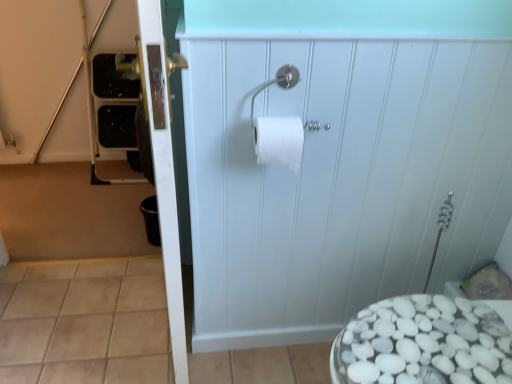
The width and height of the screenshot is (512, 384). I want to click on white matte toilet paper at center, so tap(279, 141).

The width and height of the screenshot is (512, 384). I want to click on white matte cabinet at center, which is counted as the first screen door, starting from the right, so click(x=340, y=180).

Is white matte toilet paper at center positioned with its back to white glossy door at left, acting as the first screen door starting from the left?

No, white matte toilet paper at center is not facing the opposite direction of white glossy door at left, acting as the first screen door starting from the left.

Is white matte toilet paper at center smaller than white glossy door at left, acting as the first screen door starting from the left?

Indeed, white matte toilet paper at center has a smaller size compared to white glossy door at left, acting as the first screen door starting from the left.

Which object is wider, white matte toilet paper at center or white glossy door at left, the 2th screen door in the right-to-left sequence?

white glossy door at left, the 2th screen door in the right-to-left sequence.

Does point (259, 121) appear closer or farther from the camera than point (165, 87)?

Point (259, 121) is positioned farther from the camera compared to point (165, 87).

Would you say white matte cabinet at center, which is counted as the first screen door, starting from the right, is inside or outside silver metallic toilet paper holder at upper center?

white matte cabinet at center, which is counted as the first screen door, starting from the right, lies outside silver metallic toilet paper holder at upper center.

From the picture: Considering the relative positions of white matte cabinet at center, which is counted as the first screen door, starting from the right, and silver metallic toilet paper holder at upper center in the image provided, is white matte cabinet at center, which is counted as the first screen door, starting from the right, to the left of silver metallic toilet paper holder at upper center from the viewer's perspective?

No, white matte cabinet at center, which is counted as the first screen door, starting from the right, is not to the left of silver metallic toilet paper holder at upper center.

Which is behind, point (481, 171) or point (296, 81)?

The point (481, 171) is farther.

What are the coordinates of `the 2nd screen door positioned below the silver metallic toilet paper holder at upper center (from the image's perspective)` in the screenshot? It's located at (340, 180).

Visually, is white matte toilet paper at center positioned to the left or to the right of silver metallic toilet paper holder at upper center?

white matte toilet paper at center is positioned on silver metallic toilet paper holder at upper center's left side.

Where is `towel bar in front of the white matte toilet paper at center`? The image size is (512, 384). towel bar in front of the white matte toilet paper at center is located at coordinates (279, 83).

Which is behind, white matte toilet paper at center or silver metallic toilet paper holder at upper center?

white matte toilet paper at center is further away from the camera.

Can you confirm if white matte toilet paper at center is shorter than silver metallic toilet paper holder at upper center?

Incorrect, the height of white matte toilet paper at center does not fall short of that of silver metallic toilet paper holder at upper center.

Considering the relative positions of silver metallic toilet paper holder at upper center and white glossy door at left, acting as the first screen door starting from the left, in the image provided, is silver metallic toilet paper holder at upper center to the right of white glossy door at left, acting as the first screen door starting from the left, from the viewer's perspective?

Indeed, silver metallic toilet paper holder at upper center is positioned on the right side of white glossy door at left, acting as the first screen door starting from the left.

Would you say silver metallic toilet paper holder at upper center is a long distance from white glossy door at left, acting as the first screen door starting from the left?

No, there isn't a large distance between silver metallic toilet paper holder at upper center and white glossy door at left, acting as the first screen door starting from the left.

Which is behind, point (290, 86) or point (159, 150)?

Point (290, 86)

Is silver metallic toilet paper holder at upper center oriented towards white glossy door at left, acting as the first screen door starting from the left?

No.

Measure the distance between white matte cabinet at center, which is counted as the first screen door, starting from the right, and white matte toilet paper at center.

The distance of white matte cabinet at center, which is counted as the first screen door, starting from the right, from white matte toilet paper at center is 12.90 inches.

Based on their sizes in the image, would you say white matte cabinet at center, which is counted as the second screen door, starting from the left, is bigger or smaller than white matte toilet paper at center?

white matte cabinet at center, which is counted as the second screen door, starting from the left, is bigger than white matte toilet paper at center.

Looking at this image, is white matte cabinet at center, which is counted as the first screen door, starting from the right, aimed at white matte toilet paper at center?

Yes, white matte cabinet at center, which is counted as the first screen door, starting from the right, is oriented towards white matte toilet paper at center.

What's the angular difference between white matte cabinet at center, which is counted as the second screen door, starting from the left, and white matte toilet paper at center's facing directions?

The facing directions of white matte cabinet at center, which is counted as the second screen door, starting from the left, and white matte toilet paper at center are 0.766 degrees apart.

Which object is wider, white matte cabinet at center, which is counted as the first screen door, starting from the right, or white glossy door at left, acting as the first screen door starting from the left?

white glossy door at left, acting as the first screen door starting from the left, is wider.

Which point is more forward, (469,259) or (148,50)?

The point (148,50) is more forward.

Is white matte cabinet at center, which is counted as the second screen door, starting from the left, situated inside white glossy door at left, acting as the first screen door starting from the left, or outside?

white matte cabinet at center, which is counted as the second screen door, starting from the left, is not enclosed by white glossy door at left, acting as the first screen door starting from the left.

From the image's perspective, is white glossy door at left, acting as the first screen door starting from the left, on silver metallic toilet paper holder at upper center?

Actually, white glossy door at left, acting as the first screen door starting from the left, appears below silver metallic toilet paper holder at upper center in the image.

Considering the sizes of objects white glossy door at left, acting as the first screen door starting from the left, and silver metallic toilet paper holder at upper center in the image provided, who is taller, white glossy door at left, acting as the first screen door starting from the left, or silver metallic toilet paper holder at upper center?

Standing taller between the two is white glossy door at left, acting as the first screen door starting from the left.

Is white glossy door at left, acting as the first screen door starting from the left, in front of or behind silver metallic toilet paper holder at upper center in the image?

Clearly, white glossy door at left, acting as the first screen door starting from the left, is in front of silver metallic toilet paper holder at upper center.

Image resolution: width=512 pixels, height=384 pixels. What are the coordinates of `toilet paper that is above the white glossy door at left, the 2th screen door in the right-to-left sequence (from the image's perspective)` in the screenshot? It's located at (279, 141).

In order to click on towel bar on the left of white matte cabinet at center, which is counted as the second screen door, starting from the left in this screenshot , I will do `click(279, 83)`.

Considering their positions, is white glossy door at left, the 2th screen door in the right-to-left sequence, positioned further to white matte toilet paper at center than white matte cabinet at center, which is counted as the first screen door, starting from the right?

Based on the image, white matte cabinet at center, which is counted as the first screen door, starting from the right, appears to be further to white matte toilet paper at center.

Estimate the real-world distances between objects in this image. Which object is closer to white glossy door at left, acting as the first screen door starting from the left, white matte cabinet at center, which is counted as the second screen door, starting from the left, or silver metallic toilet paper holder at upper center?

silver metallic toilet paper holder at upper center is positioned closer to the anchor white glossy door at left, acting as the first screen door starting from the left.

Estimate the real-world distances between objects in this image. Which object is further from silver metallic toilet paper holder at upper center, white matte toilet paper at center or white glossy door at left, the 2th screen door in the right-to-left sequence?

Based on the image, white glossy door at left, the 2th screen door in the right-to-left sequence, appears to be further to silver metallic toilet paper holder at upper center.

Based on their spatial positions, is silver metallic toilet paper holder at upper center or white matte cabinet at center, which is counted as the first screen door, starting from the right, closer to white matte toilet paper at center?

silver metallic toilet paper holder at upper center is closer to white matte toilet paper at center.

Looking at the image, which one is located closer to white matte cabinet at center, which is counted as the second screen door, starting from the left, white matte toilet paper at center or white glossy door at left, the 2th screen door in the right-to-left sequence?

Based on the image, white matte toilet paper at center appears to be nearer to white matte cabinet at center, which is counted as the second screen door, starting from the left.

In the scene shown: When comparing their distances from white matte cabinet at center, which is counted as the second screen door, starting from the left, does white glossy door at left, the 2th screen door in the right-to-left sequence, or silver metallic toilet paper holder at upper center seem closer?

silver metallic toilet paper holder at upper center is closer to white matte cabinet at center, which is counted as the second screen door, starting from the left.

Which object lies nearer to the anchor point white matte cabinet at center, which is counted as the second screen door, starting from the left, white matte toilet paper at center or silver metallic toilet paper holder at upper center?

Among the two, white matte toilet paper at center is located nearer to white matte cabinet at center, which is counted as the second screen door, starting from the left.

Based on their spatial positions, is silver metallic toilet paper holder at upper center or white matte cabinet at center, which is counted as the first screen door, starting from the right, closer to white glossy door at left, the 2th screen door in the right-to-left sequence?

silver metallic toilet paper holder at upper center.

Find the location of a particular element. towel bar between white matte toilet paper at center and white matte cabinet at center, which is counted as the second screen door, starting from the left, from left to right is located at coordinates (279, 83).

The height and width of the screenshot is (384, 512). Identify the location of toilet paper between white glossy door at left, the 2th screen door in the right-to-left sequence, and white matte cabinet at center, which is counted as the second screen door, starting from the left, from left to right. (279, 141).

Identify the location of towel bar between white glossy door at left, the 2th screen door in the right-to-left sequence, and white matte cabinet at center, which is counted as the first screen door, starting from the right. (279, 83).

Locate an element on the screen. The height and width of the screenshot is (384, 512). toilet paper between white glossy door at left, acting as the first screen door starting from the left, and silver metallic toilet paper holder at upper center from left to right is located at coordinates 279,141.